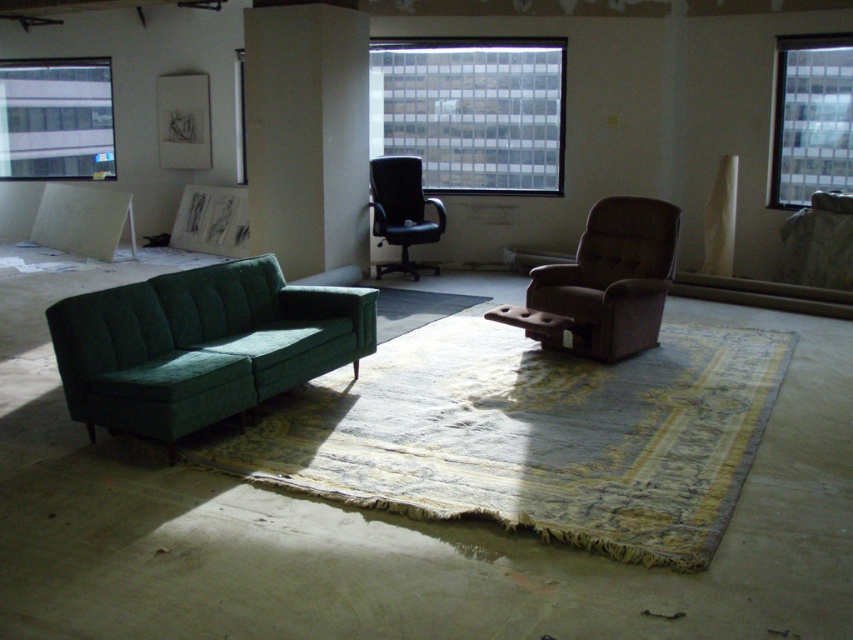
Does green fabric couch at left come in front of clear glass window at upper left?

Yes.

Between green fabric couch at left and clear glass window at upper left, which one has more height?

Standing taller between the two is clear glass window at upper left.

Locate an element on the screen. This screenshot has height=640, width=853. green fabric couch at left is located at coordinates (200, 344).

This screenshot has width=853, height=640. What are the coordinates of `green fabric couch at left` in the screenshot? It's located at (200, 344).

Can you confirm if clear glass window at center is positioned below clear glass window at upper right?

Actually, clear glass window at center is above clear glass window at upper right.

Which is above, clear glass window at center or clear glass window at upper right?

clear glass window at center

Who is more distant from viewer, (466, 108) or (811, 177)?

Positioned behind is point (466, 108).

This screenshot has width=853, height=640. I want to click on clear glass window at center, so click(x=471, y=112).

What do you see at coordinates (471, 112) in the screenshot? I see `clear glass window at center` at bounding box center [471, 112].

Where is `clear glass window at center`? clear glass window at center is located at coordinates (471, 112).

The width and height of the screenshot is (853, 640). In order to click on clear glass window at center in this screenshot , I will do `click(471, 112)`.